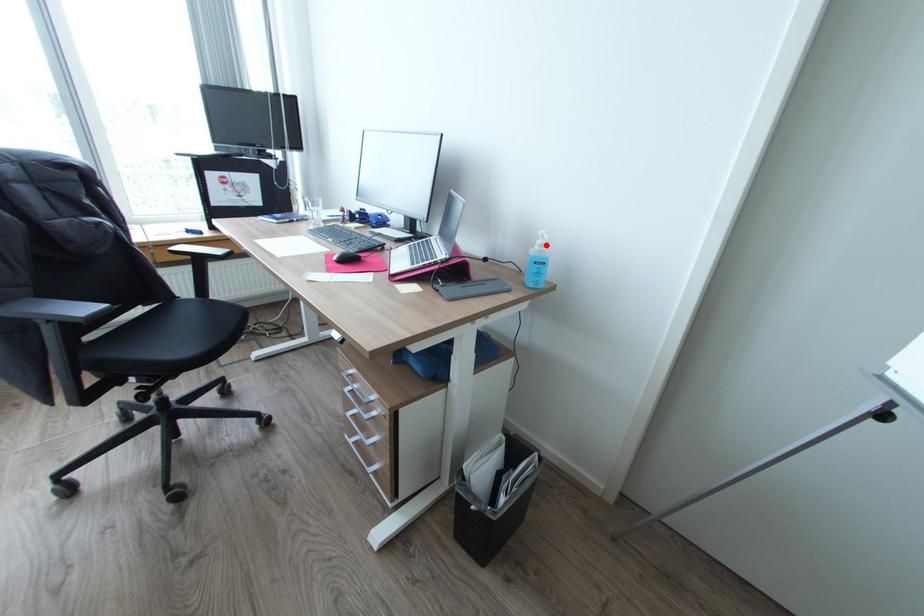
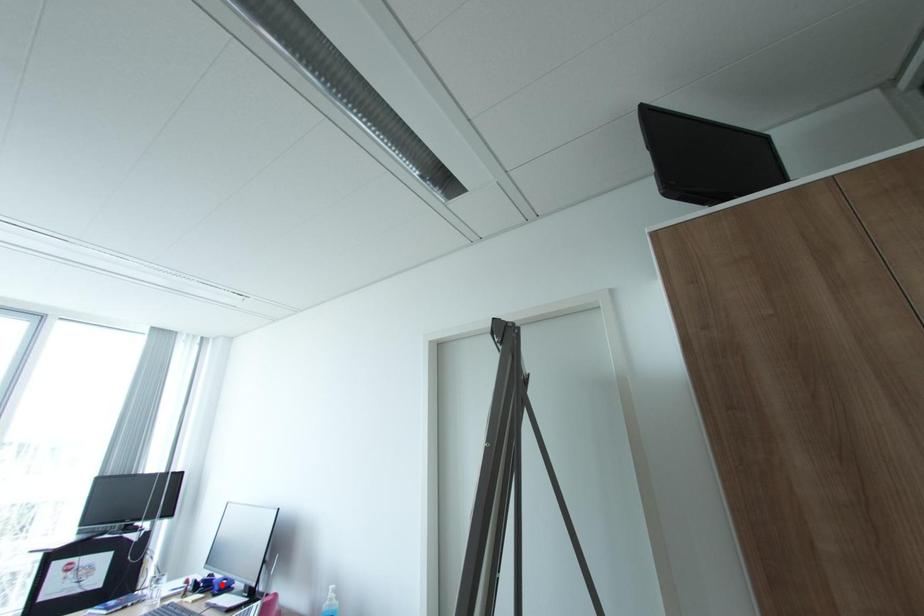
I am providing you with two images of the same scene from different viewpoints. A red point is marked on the first image and another point is marked on the second image. Do the highlighted points in image1 and image2 indicate the same real-world spot?

No